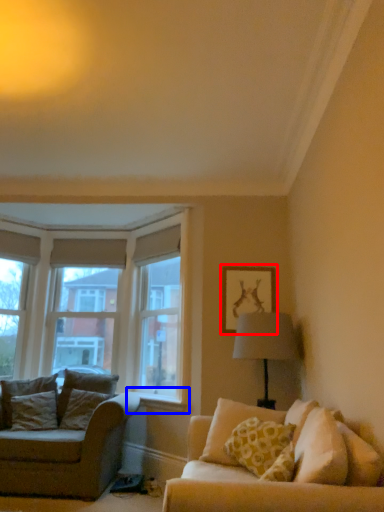
Question: Which object is closer to the camera taking this photo, picture frame (highlighted by a red box) or window sill (highlighted by a blue box)?

Choices:
 (A) picture frame
 (B) window sill

Answer: (B)